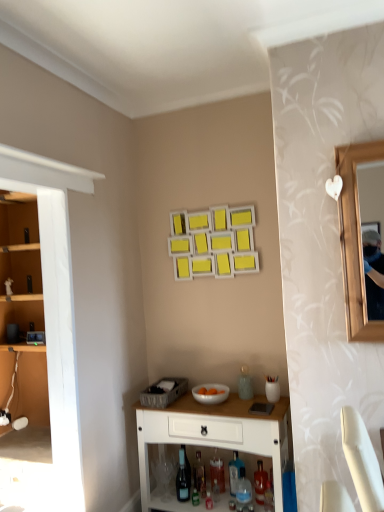
Question: Which direction should I rotate to face translucent glass bottle at lower center, the 4th bottle in the left-to-right sequence, — up or down?

Choices:
 (A) down
 (B) up

Answer: (A)

Question: Is translucent glass bottle at lower center, the 4th bottle in the left-to-right sequence, at the back of translucent glass bottle at center, the 4th bottle viewed from the right?

Choices:
 (A) yes
 (B) no

Answer: (B)

Question: From the image's perspective, is translucent glass bottle at center, the third bottle when ordered from left to right, located beneath translucent glass bottle at lower center, the 4th bottle in the left-to-right sequence?

Choices:
 (A) no
 (B) yes

Answer: (A)

Question: Considering the relative sizes of translucent glass bottle at center, the third bottle when ordered from left to right, and translucent glass bottle at lower center, the third bottle positioned from the right, in the image provided, is translucent glass bottle at center, the third bottle when ordered from left to right, shorter than translucent glass bottle at lower center, the third bottle positioned from the right,?

Choices:
 (A) no
 (B) yes

Answer: (A)

Question: Is translucent glass bottle at center, the third bottle when ordered from left to right, positioned far away from translucent glass bottle at lower center, the 4th bottle in the left-to-right sequence?

Choices:
 (A) no
 (B) yes

Answer: (A)

Question: Can you confirm if translucent glass bottle at center, the third bottle when ordered from left to right, is wider than translucent glass bottle at lower center, the 4th bottle in the left-to-right sequence?

Choices:
 (A) yes
 (B) no

Answer: (B)

Question: Is translucent glass bottle at center, the third bottle when ordered from left to right, to the left of translucent glass bottle at lower center, the third bottle positioned from the right, from the viewer's perspective?

Choices:
 (A) no
 (B) yes

Answer: (B)

Question: From the image's perspective, is white glossy bowl at lower center beneath translucent plastic bottle at lower center, the fifth bottle when ordered from left to right?

Choices:
 (A) no
 (B) yes

Answer: (A)

Question: Is white glossy bowl at lower center looking in the opposite direction of translucent plastic bottle at lower center, the fifth bottle when ordered from left to right?

Choices:
 (A) no
 (B) yes

Answer: (A)

Question: Is white glossy bowl at lower center smaller than translucent plastic bottle at lower center, positioned as the 2th bottle in right-to-left order?

Choices:
 (A) yes
 (B) no

Answer: (B)

Question: Does white glossy bowl at lower center touch translucent plastic bottle at lower center, positioned as the 2th bottle in right-to-left order?

Choices:
 (A) no
 (B) yes

Answer: (A)

Question: Could translucent plastic bottle at lower center, the fifth bottle when ordered from left to right, be considered to be inside white glossy bowl at lower center?

Choices:
 (A) no
 (B) yes

Answer: (A)

Question: Does white glossy bowl at lower center have a greater height compared to translucent plastic bottle at lower center, the fifth bottle when ordered from left to right?

Choices:
 (A) yes
 (B) no

Answer: (B)

Question: Does translucent glass bottle at lower center, the first bottle viewed from the left, appear on the left side of translucent glass wine bottle at lower center?

Choices:
 (A) no
 (B) yes

Answer: (A)